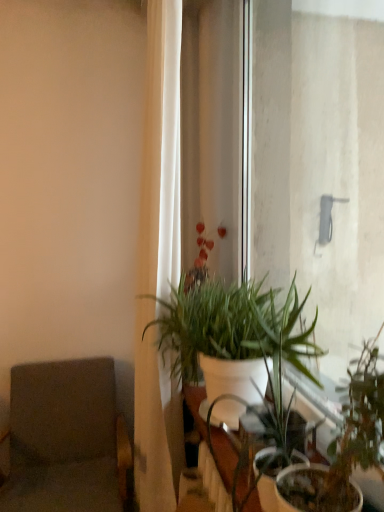
Question: Is white fabric curtain at left at the back of gray fabric swivel chair at left?

Choices:
 (A) no
 (B) yes

Answer: (A)

Question: Would you consider gray fabric swivel chair at left to be distant from white fabric curtain at left?

Choices:
 (A) no
 (B) yes

Answer: (A)

Question: Can you confirm if gray fabric swivel chair at left is shorter than white fabric curtain at left?

Choices:
 (A) yes
 (B) no

Answer: (A)

Question: Is gray fabric swivel chair at left behind white fabric curtain at left?

Choices:
 (A) no
 (B) yes

Answer: (B)

Question: Is white fabric curtain at left completely or partially inside gray fabric swivel chair at left?

Choices:
 (A) yes
 (B) no

Answer: (B)

Question: Is gray fabric swivel chair at left aimed at white fabric curtain at left?

Choices:
 (A) no
 (B) yes

Answer: (A)

Question: Is white fabric curtain at left taller than green matte plant at center, acting as the first houseplant starting from the front?

Choices:
 (A) yes
 (B) no

Answer: (A)

Question: From the image's perspective, would you say white fabric curtain at left is shown under green matte plant at center, arranged as the second houseplant when viewed from the back?

Choices:
 (A) no
 (B) yes

Answer: (A)

Question: Does white fabric curtain at left have a lesser height compared to green matte plant at center, arranged as the second houseplant when viewed from the back?

Choices:
 (A) yes
 (B) no

Answer: (B)

Question: Is white fabric curtain at left smaller than green matte plant at center, arranged as the second houseplant when viewed from the back?

Choices:
 (A) no
 (B) yes

Answer: (A)

Question: Is white fabric curtain at left facing towards green matte plant at center, arranged as the second houseplant when viewed from the back?

Choices:
 (A) yes
 (B) no

Answer: (B)

Question: Can you see white fabric curtain at left touching green matte plant at center, acting as the first houseplant starting from the front?

Choices:
 (A) no
 (B) yes

Answer: (A)

Question: Considering the relative sizes of white glossy table at center and green matte plant at center, arranged as the second houseplant when viewed from the back, in the image provided, is white glossy table at center shorter than green matte plant at center, arranged as the second houseplant when viewed from the back,?

Choices:
 (A) no
 (B) yes

Answer: (A)